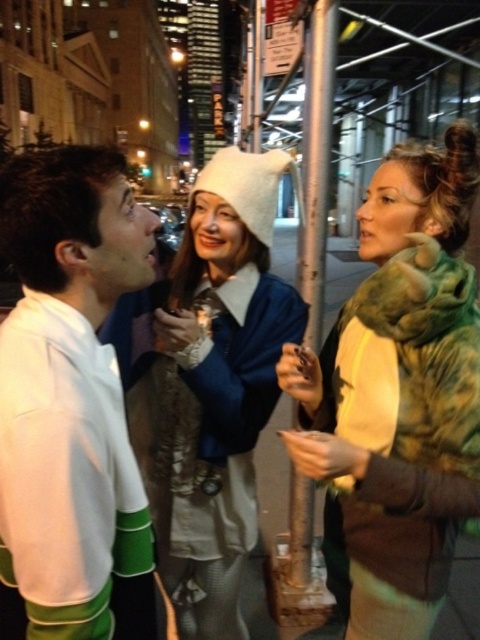
You are a photographer standing at the center of the street. You want to take a photo of both point (450, 554) and point (116, 241) in the frame. Which point is closer to your camera lens?

Point (116, 241) is closer to the camera lens because the description states that point (450, 554) is further away than point (116, 241).

You are a fashion designer observing the urban night scene. You notice the green fur coat at right and the white fabric shirt at left. Which clothing item appears bigger in size?

The green fur coat at right is larger in size compared to the white fabric shirt at left.

You are a photographer standing in the middle of the street, and you want to take a photo of the green fur coat at right and the white fuzzy hat at center. Which of the two objects is located to the right of the other?

The green fur coat at right is positioned on the right side of the white fuzzy hat at center.